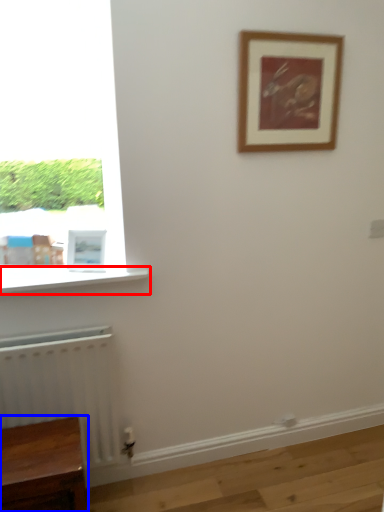
Question: Which object is closer to the camera taking this photo, window sill (highlighted by a red box) or furniture (highlighted by a blue box)?

Choices:
 (A) window sill
 (B) furniture

Answer: (B)